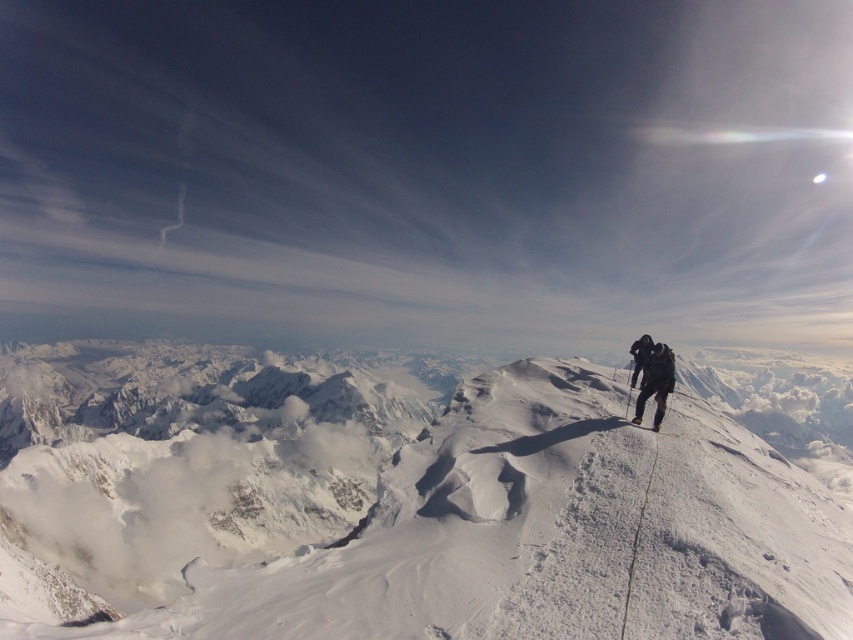
You are a hiker planning to take a photo of the snowy mountain landscape. You want to ensure that both the point at coordinates point (625,488) and the point at coordinates point (643,404) are visible in your shot. Based on their positions, which point will appear closer to the camera in the photo?

Point (625,488) is closer to the viewer than point (643,404), so it will appear closer in the photo.